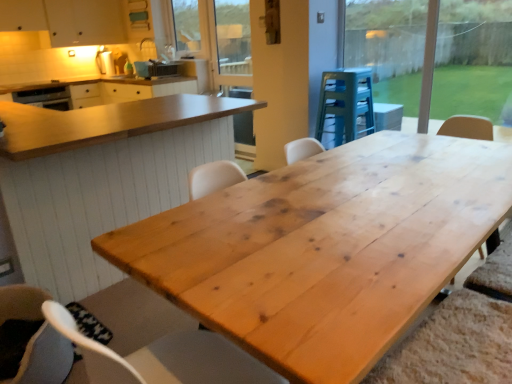
Question: From a real-world perspective, is transparent glass window at upper right positioned above or below soft gray fabric chair at lower left?

Choices:
 (A) above
 (B) below

Answer: (A)

Question: Considering the relative positions of transparent glass window at upper right and soft gray fabric chair at lower left in the image provided, is transparent glass window at upper right to the left or to the right of soft gray fabric chair at lower left?

Choices:
 (A) right
 (B) left

Answer: (A)

Question: Based on their relative distances, which object is farther from the soft gray fabric chair at lower left?

Choices:
 (A) wooden screen door at upper center
 (B) transparent glass window at upper right
 (C) matte black toaster at upper center, marked as the first appliance in a back-to-front arrangement
 (D) wooden stool at center, which is the 1th appliance from right to left
 (E) natural wood table at center, which is the second table from front to back

Answer: (C)

Question: Estimate the real-world distances between objects in this image. Which object is closer to the natural wood table at center, which is the second table from front to back?

Choices:
 (A) transparent glass window at upper right
 (B) wooden stool at center, which ranks as the 1th appliance in front-to-back order
 (C) clear glass window screen at upper center
 (D) soft gray fabric chair at lower left
 (E) matte black toaster at upper center, arranged as the second appliance when viewed from the front

Answer: (D)